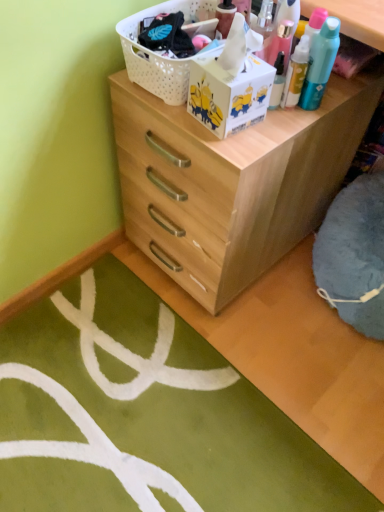
Question: Is natural wood chest of drawers at center at the back of white plastic basket at upper center?

Choices:
 (A) yes
 (B) no

Answer: (B)

Question: Is white plastic basket at upper center far from natural wood chest of drawers at center?

Choices:
 (A) yes
 (B) no

Answer: (B)

Question: Is white plastic basket at upper center positioned behind natural wood chest of drawers at center?

Choices:
 (A) no
 (B) yes

Answer: (B)

Question: Is white plastic basket at upper center bigger than natural wood chest of drawers at center?

Choices:
 (A) no
 (B) yes

Answer: (A)

Question: From the image's perspective, is white plastic basket at upper center on natural wood chest of drawers at center?

Choices:
 (A) no
 (B) yes

Answer: (B)

Question: Considering the relative positions of white plastic basket at upper center and natural wood chest of drawers at center in the image provided, is white plastic basket at upper center to the left of natural wood chest of drawers at center from the viewer's perspective?

Choices:
 (A) no
 (B) yes

Answer: (B)

Question: Is natural wood chest of drawers at center to the left of white plastic basket at upper center from the viewer's perspective?

Choices:
 (A) no
 (B) yes

Answer: (A)

Question: Is natural wood chest of drawers at center bigger than white plastic basket at upper center?

Choices:
 (A) yes
 (B) no

Answer: (A)

Question: Considering the relative sizes of natural wood chest of drawers at center and white plastic basket at upper center in the image provided, is natural wood chest of drawers at center shorter than white plastic basket at upper center?

Choices:
 (A) no
 (B) yes

Answer: (A)

Question: From the image's perspective, does natural wood chest of drawers at center appear lower than white plastic basket at upper center?

Choices:
 (A) no
 (B) yes

Answer: (B)

Question: Does natural wood chest of drawers at center appear on the right side of white plastic basket at upper center?

Choices:
 (A) no
 (B) yes

Answer: (B)

Question: Can we say natural wood chest of drawers at center lies outside white plastic basket at upper center?

Choices:
 (A) no
 (B) yes

Answer: (B)

Question: Is natural wood chest of drawers at center to the left or to the right of white plastic basket at upper center in the image?

Choices:
 (A) right
 (B) left

Answer: (A)